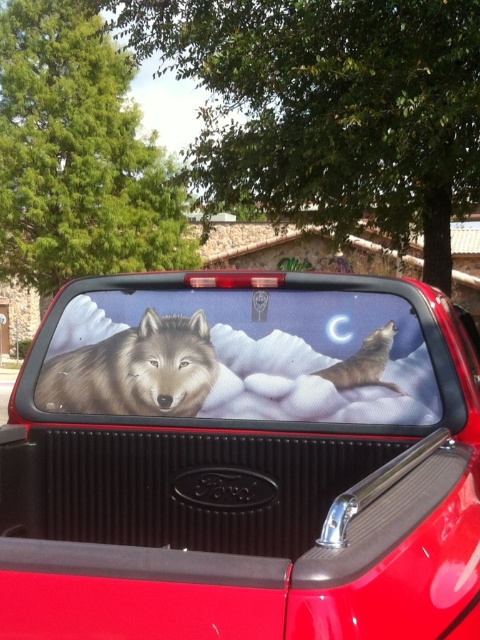
Who is positioned more to the right, matte plastic truck bed at center or gray matte wolf at upper right?

From the viewer's perspective, gray matte wolf at upper right appears more on the right side.

Is point (369, 502) positioned after point (382, 349)?

No, (369, 502) is closer to viewer.

Where is `matte plastic truck bed at center`? This screenshot has height=640, width=480. matte plastic truck bed at center is located at coordinates point(240,464).

Who is positioned more to the right, matte plastic truck bed at center or gray matte wolf at center?

matte plastic truck bed at center is more to the right.

Does matte plastic truck bed at center have a greater height compared to gray matte wolf at center?

Yes.

Who is more forward, (x=78, y=616) or (x=127, y=330)?

Point (x=78, y=616)

Identify the location of matte plastic truck bed at center. Image resolution: width=480 pixels, height=640 pixels. (240, 464).

Which is in front, point (46, 384) or point (349, 385)?

Positioned in front is point (349, 385).

Does gray matte wolf at center have a larger size compared to gray matte wolf at upper right?

Correct, gray matte wolf at center is larger in size than gray matte wolf at upper right.

Who is more distant from viewer, (x=113, y=360) or (x=316, y=372)?

The point (x=113, y=360) is more distant.

Locate an element on the screen. The width and height of the screenshot is (480, 640). gray matte wolf at center is located at coordinates (134, 371).